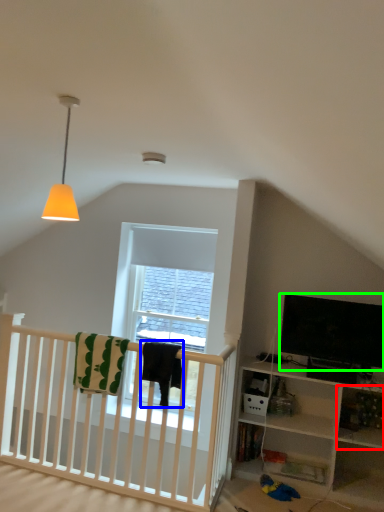
Question: Which is nearer to the shelf (highlighted by a red box)? blanket (highlighted by a blue box) or television (highlighted by a green box).

Choices:
 (A) blanket
 (B) television

Answer: (B)